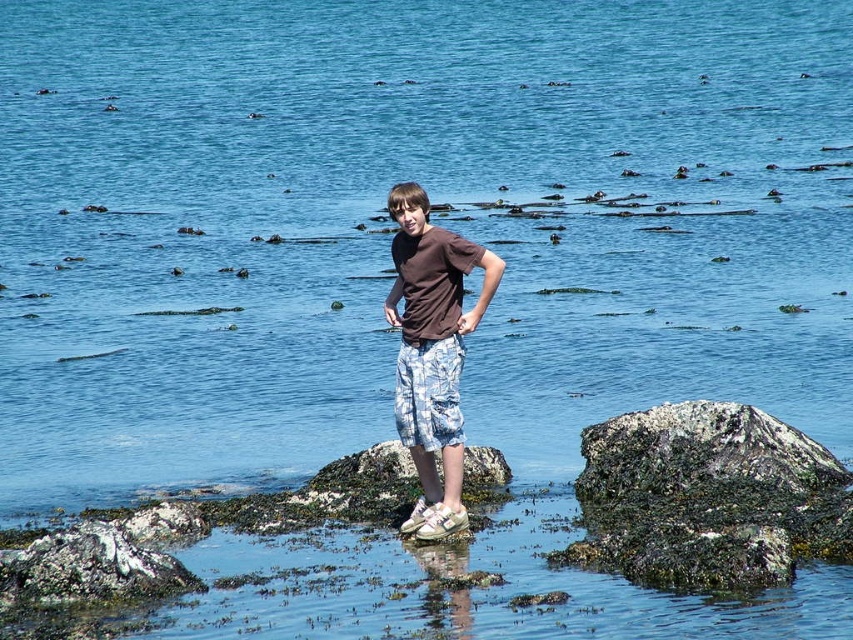
Consider the image. Is green mossy rock at lower right above brown cotton shirt at center?

No.

Is green mossy rock at lower right taller than brown cotton shirt at center?

Yes.

What are the coordinates of `green mossy rock at lower right` in the screenshot? It's located at (706, 499).

Who is taller, brown cotton shirt at center or blue camouflage shorts at center?

With more height is blue camouflage shorts at center.

Can you confirm if brown cotton shirt at center is thinner than blue camouflage shorts at center?

Yes.

Locate an element on the screen. This screenshot has width=853, height=640. brown cotton shirt at center is located at coordinates (432, 352).

Image resolution: width=853 pixels, height=640 pixels. What are the coordinates of `brown cotton shirt at center` in the screenshot? It's located at (432, 352).

Is point (585, 436) farther from camera compared to point (402, 380)?

Yes, point (585, 436) is behind point (402, 380).

Where is `green mossy rock at lower right`? The width and height of the screenshot is (853, 640). green mossy rock at lower right is located at coordinates (706, 499).